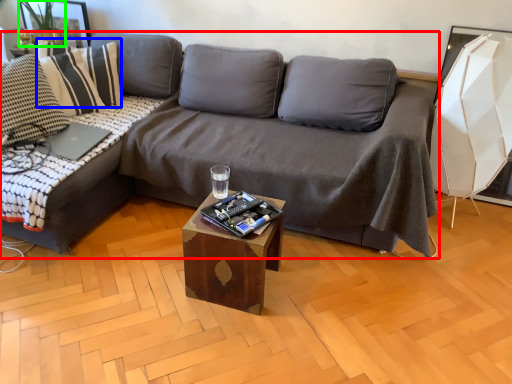
Question: Based on their relative distances, which object is nearer to studio couch (highlighted by a red box)? Choose from pillow (highlighted by a blue box) and plant (highlighted by a green box).

Choices:
 (A) pillow
 (B) plant

Answer: (A)